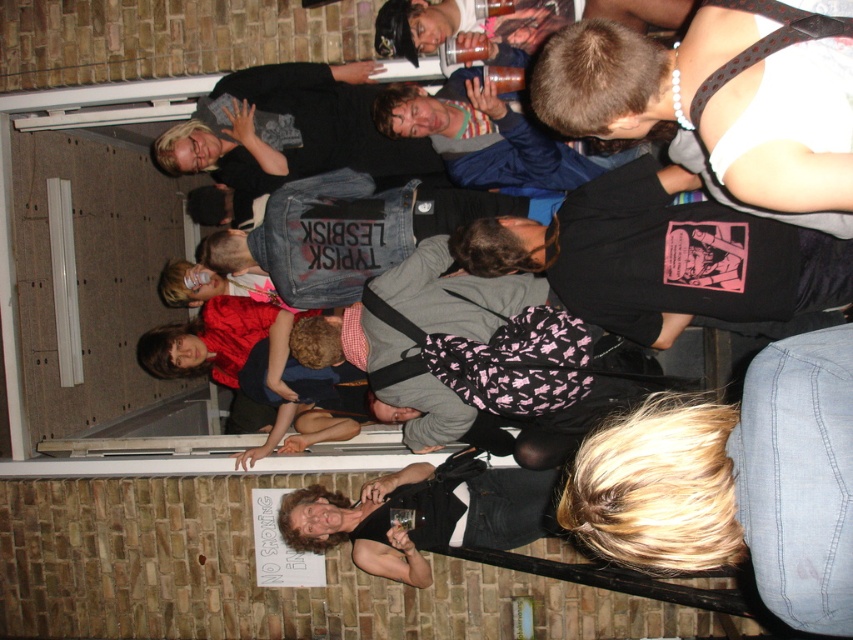
Is the position of black denim shirt at upper right less distant than that of denim jacket at center?

Yes, black denim shirt at upper right is closer to the viewer.

Does black denim shirt at upper right have a larger size compared to denim jacket at center?

Actually, black denim shirt at upper right might be smaller than denim jacket at center.

Between point (717, 44) and point (283, 260), which one is positioned behind?

The point (283, 260) is behind.

Find the location of a particular element. The image size is (853, 640). black denim shirt at upper right is located at coordinates (718, 106).

Is denim jacket at center closer to camera compared to shiny black shirt at lower center?

No, denim jacket at center is further to the viewer.

Who is more forward, [345,198] or [483,499]?

Point [483,499]

Is point (306, 284) positioned before point (543, 497)?

No, it is not.

This screenshot has width=853, height=640. Identify the location of denim jacket at center. (349, 232).

Is black denim shirt at upper right to the right of shiny black shirt at lower center from the viewer's perspective?

Yes, black denim shirt at upper right is to the right of shiny black shirt at lower center.

From the picture: Can you confirm if black denim shirt at upper right is positioned above shiny black shirt at lower center?

Yes.

Describe the element at coordinates (718, 106) in the screenshot. This screenshot has height=640, width=853. I see `black denim shirt at upper right` at that location.

The image size is (853, 640). Identify the location of black denim shirt at upper right. (718, 106).